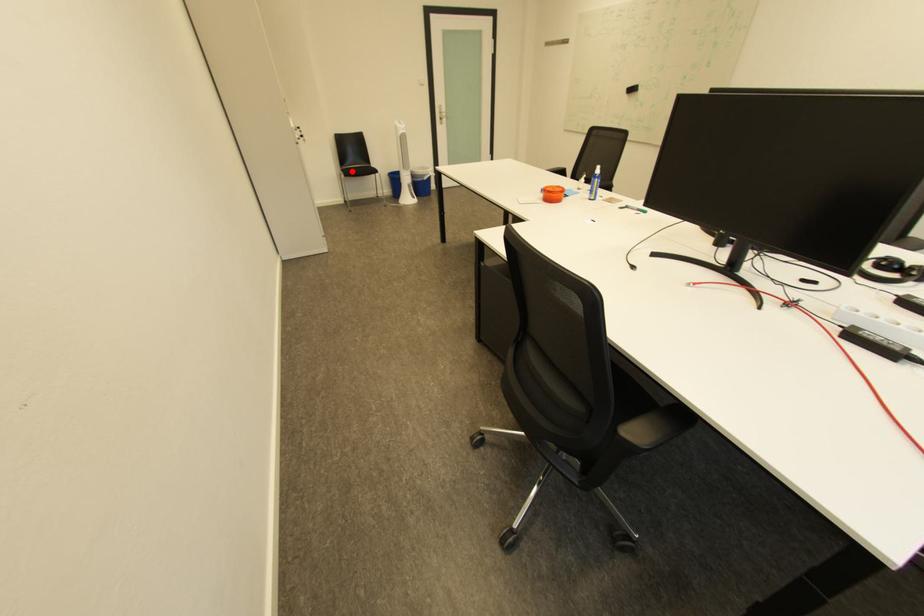
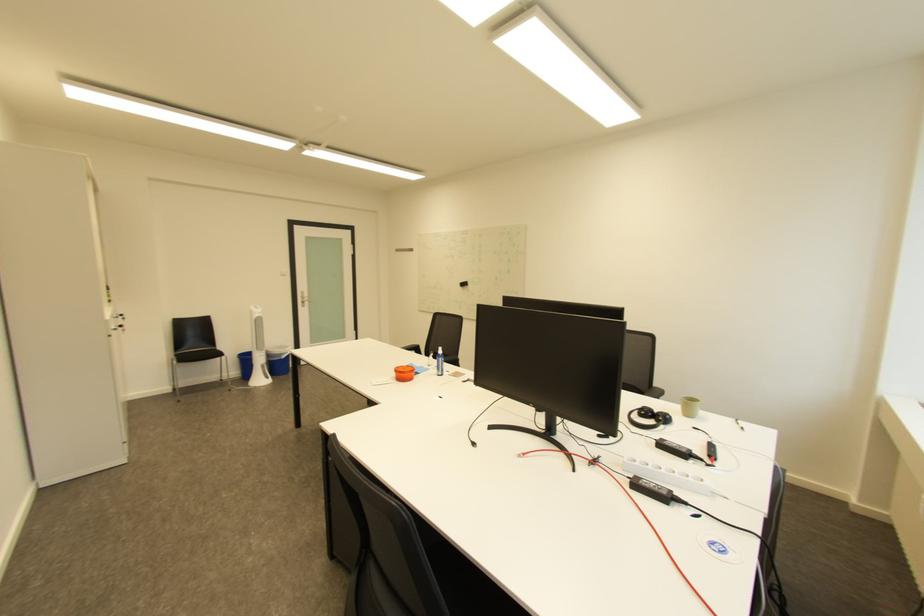
The point at the highlighted location is marked in the first image. Where is the corresponding point in the second image?

(186, 357)